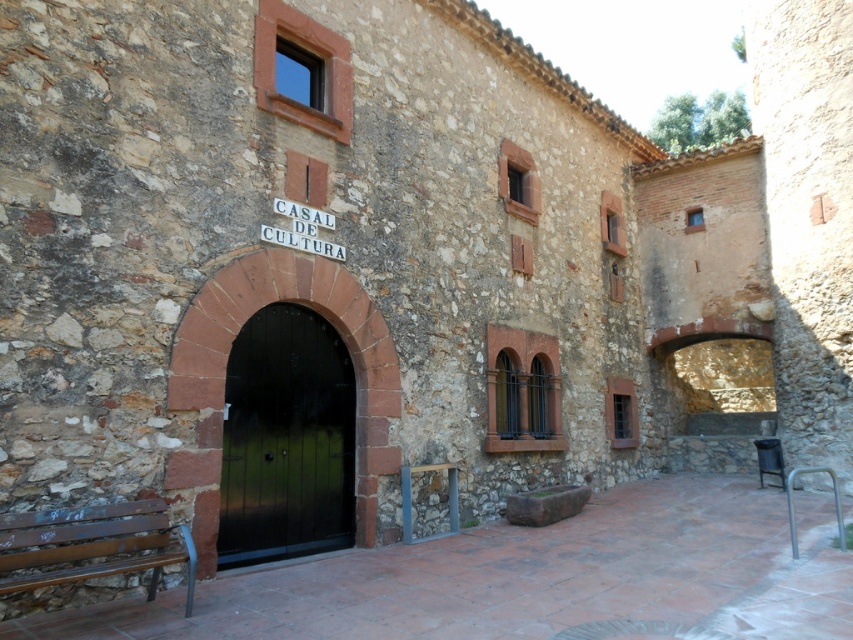
You are a visitor approaching the CASAL DE CULTURA entrance. You see a brown wooden bench at lower left and a rustic wood bench at lower left. Which bench is closer to the entrance?

The brown wooden bench at lower left is closer to the entrance because the rustic wood bench at lower left is positioned behind it.

You are standing at the entrance of the CASAL DE CULTURA and want to sit down. Where is the brown wooden bench at lower left located?

The brown wooden bench at lower left is located at point (532, 579).